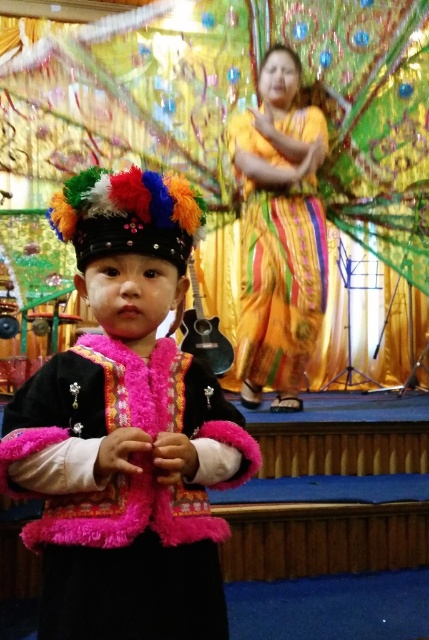
Question: Is fuzzy pink vest at center to the left of shiny yellow fabric dress at center from the viewer's perspective?

Choices:
 (A) yes
 (B) no

Answer: (A)

Question: Which of the following is the closest to the observer?

Choices:
 (A) shiny yellow fabric dress at center
 (B) fuzzy pink vest at center

Answer: (B)

Question: Is fuzzy pink vest at center below shiny yellow fabric dress at center?

Choices:
 (A) yes
 (B) no

Answer: (A)

Question: Is fuzzy pink vest at center bigger than shiny yellow fabric dress at center?

Choices:
 (A) yes
 (B) no

Answer: (B)

Question: Which point is closer to the camera taking this photo?

Choices:
 (A) (271, 332)
 (B) (153, 492)

Answer: (B)